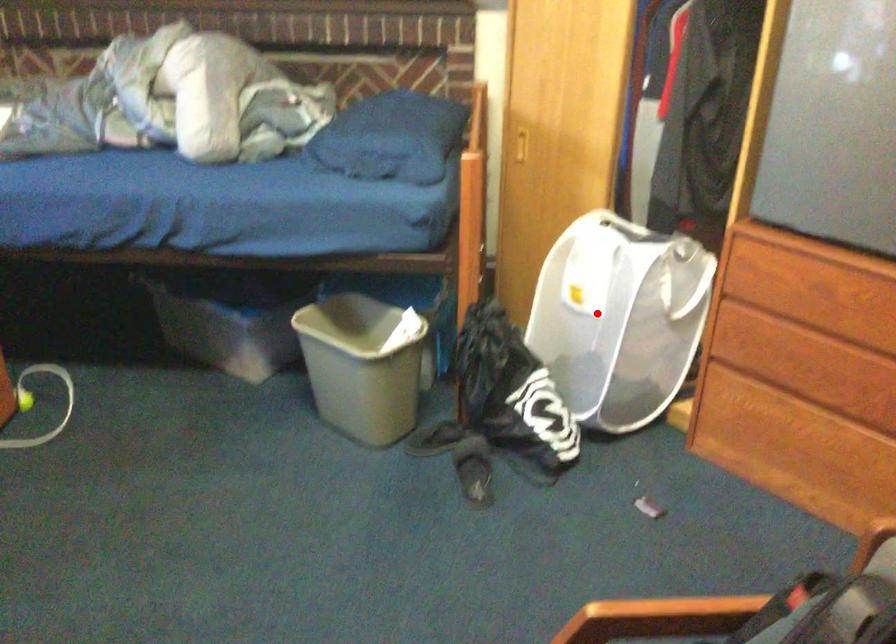
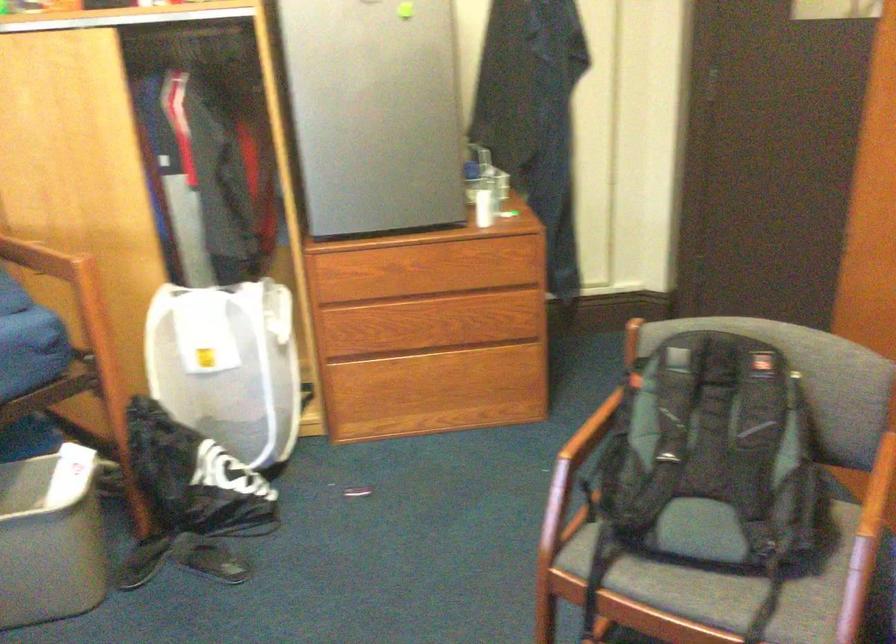
Where in the second image is the point corresponding to the highlighted location from the first image?

(228, 365)